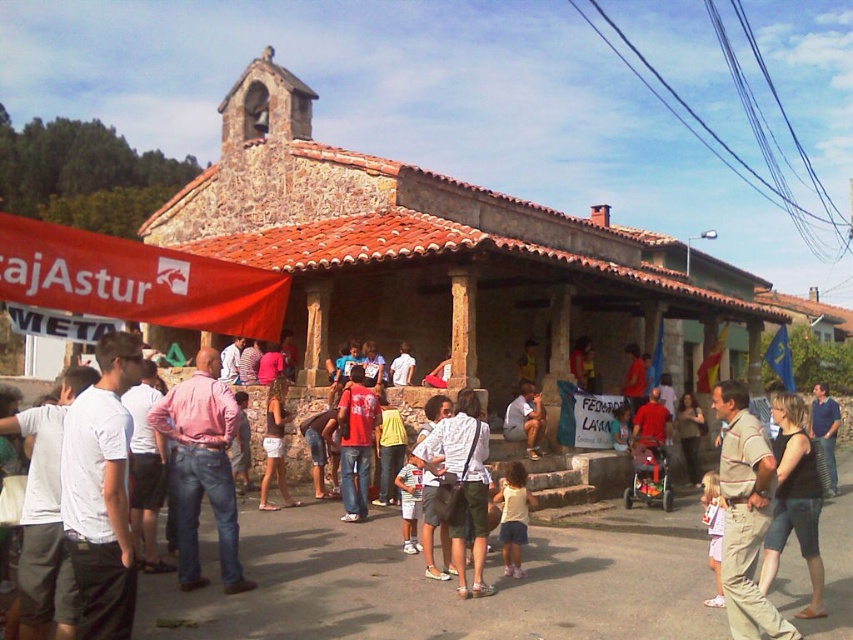
You are organizing a community event and need to determine if the red fabric banner at left can be hung above the entrance without touching the blue denim jeans at lower right. Based on their heights, will the banner be tall enough to avoid contact?

The red fabric banner at left is shorter than the blue denim jeans at lower right, so the banner may not be tall enough to avoid contact with the jeans if hung above the entrance.

You are an event planner standing in front of the brown stone church at center and the black cotton tank top at center. Which object is located to the right of the other?

The brown stone church at center is positioned on the right side of black cotton tank top at center.

In the scene shown: You are standing in front of the brown stone church at center and want to hand a flyer to the person wearing the black cotton tank top at center. Since both are at center, can you reach them directly without moving around others?

The brown stone church at center is further to the viewer than the black cotton tank top at center, so the person in the black cotton tank top at center is closer to you. You can reach them directly since they are in front of the church and not blocked by it.